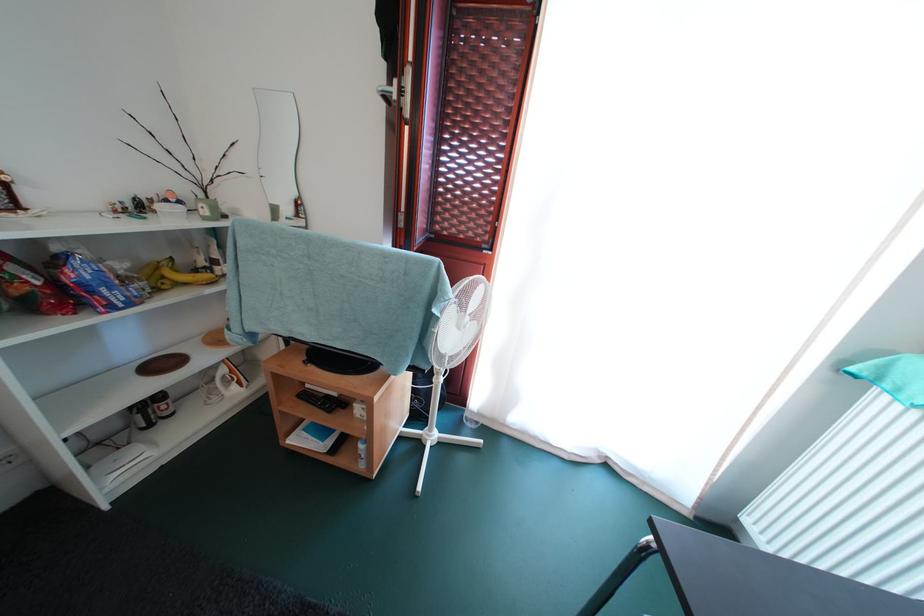
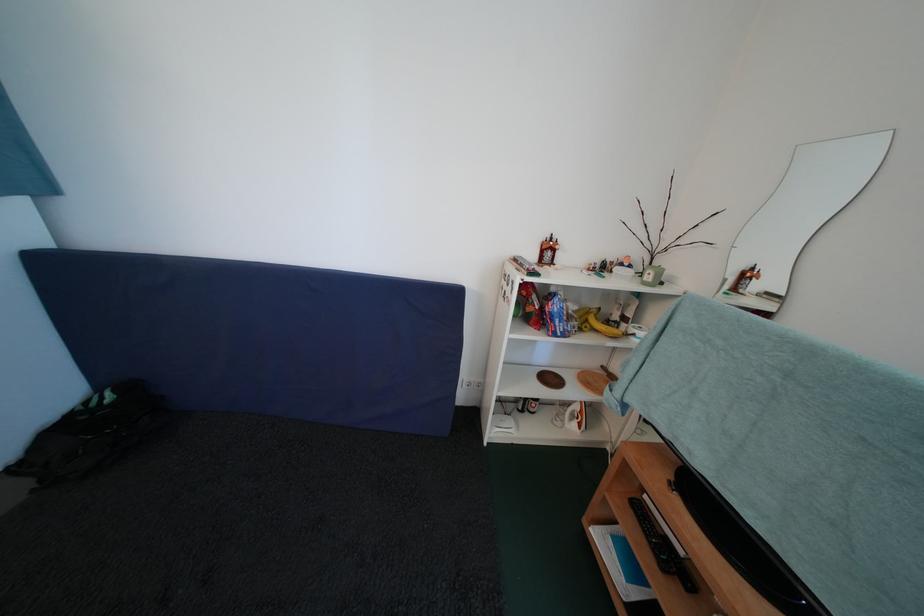
Find the pixel in the second image that matches point (337, 416) in the first image.

(671, 573)